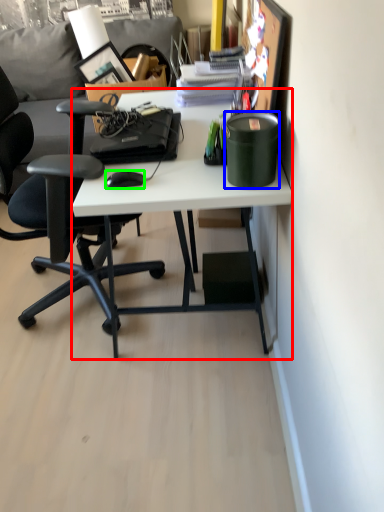
Question: Considering the real-world distances, which object is closest to desk (highlighted by a red box)? stationery (highlighted by a blue box) or mouse (highlighted by a green box).

Choices:
 (A) stationery
 (B) mouse

Answer: (A)